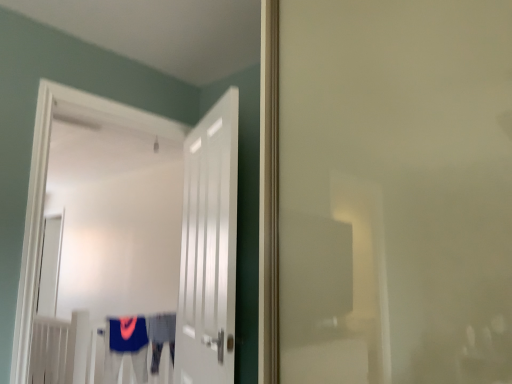
Question: From the image's perspective, is blue fabric robe at center, which ranks as the 2th robe in left-to-right order, positioned above or below white glossy door at center, acting as the first door starting from the left?

Choices:
 (A) above
 (B) below

Answer: (B)

Question: Is blue fabric robe at center, which ranks as the 2th robe in left-to-right order, wider or thinner than white glossy door at center, the 2th door from the right?

Choices:
 (A) wide
 (B) thin

Answer: (A)

Question: Which is farther from the white glossy door at center, which is the 2th door in left-to-right order?

Choices:
 (A) white glossy door at center, the 2th door from the right
 (B) blue fabric robe at center, which ranks as the 2th robe in left-to-right order
 (C) blue fabric robe at lower center, the 2th robe in the right-to-left sequence

Answer: (A)

Question: Based on their relative distances, which object is farther from the white glossy door at center, acting as the first door starting from the left?

Choices:
 (A) blue fabric robe at lower center, the 2th robe in the right-to-left sequence
 (B) white glossy door at center, the first door viewed from the right
 (C) blue fabric robe at center, which ranks as the 2th robe in left-to-right order

Answer: (B)